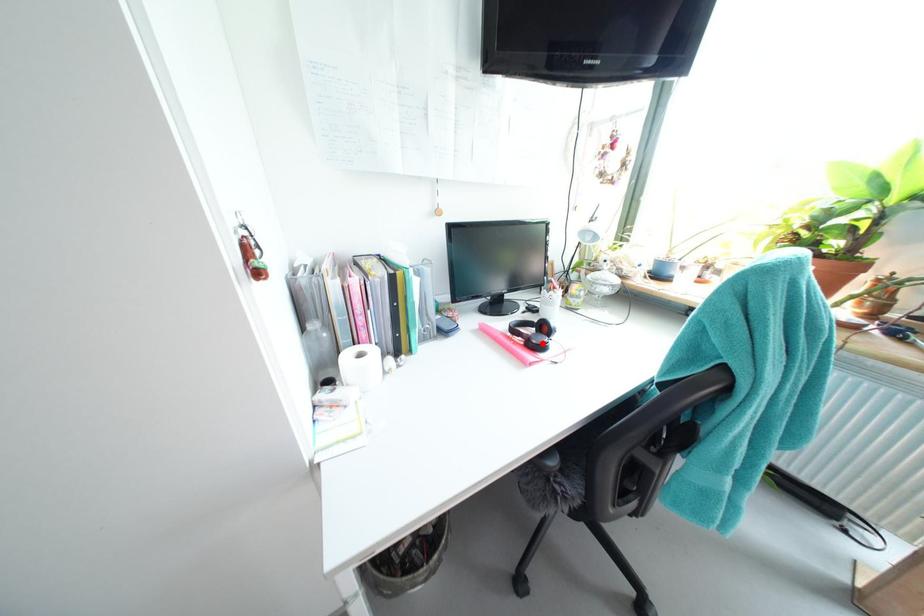
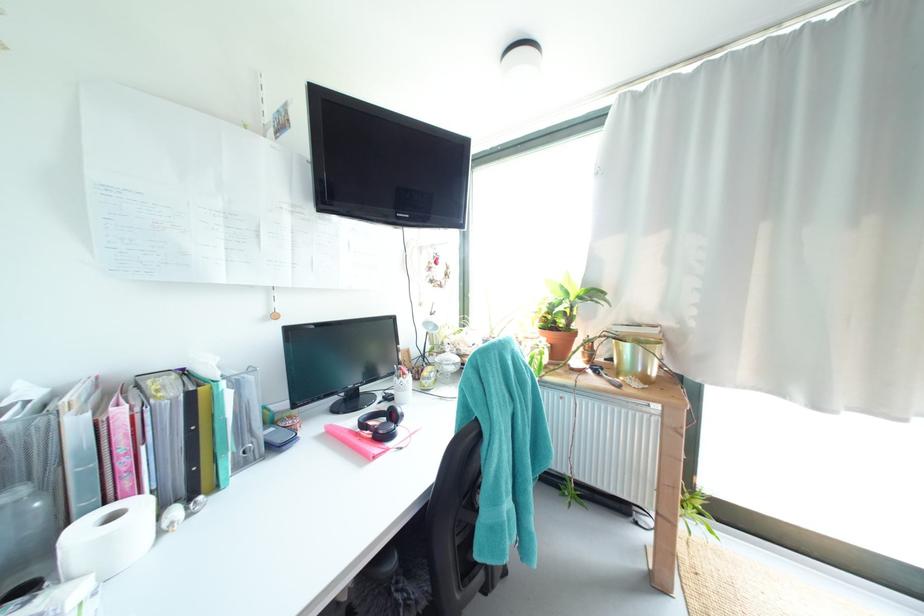
Where in the second image is the point corresponding to the highlighted location from the first image?

(388, 434)